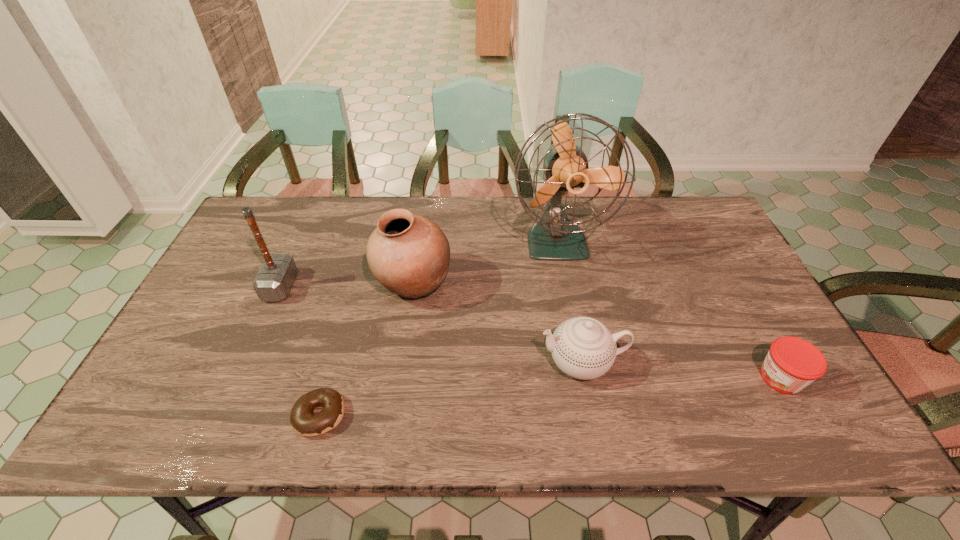
In the image, there is a desktop. At what (x,y) coordinates should I click in order to perform the action: click on vacant space at the far edge. Please return your answer as a coordinate pair (x, y). This screenshot has height=540, width=960. Looking at the image, I should click on (x=424, y=198).

The height and width of the screenshot is (540, 960). Find the location of `vacant region at the near edge of the desktop`. vacant region at the near edge of the desktop is located at coordinates (439, 440).

In order to click on vacant space at the right edge of the desktop in this screenshot , I will do `click(775, 394)`.

In the image, there is a desktop. At what (x,y) coordinates should I click in order to perform the action: click on free space at the far left corner. Please return your answer as a coordinate pair (x, y). This screenshot has width=960, height=540. Looking at the image, I should click on (250, 230).

Locate an element on the screen. This screenshot has width=960, height=540. vacant space at the far right corner of the desktop is located at coordinates (686, 206).

Find the location of a particular element. The height and width of the screenshot is (540, 960). vacant space that's between the shortest object and the fourth tallest object is located at coordinates (451, 388).

I want to click on unoccupied position between the fan and the shortest object, so click(x=439, y=328).

The image size is (960, 540). I want to click on vacant area between the hammer and the shortest object, so click(x=300, y=351).

Identify the location of empty space that is in between the second shortest object and the chinaware. (682, 370).

At what (x,y) coordinates should I click in order to perform the action: click on free spot between the chinaware and the rightmost object. Please return your answer as a coordinate pair (x, y). This screenshot has height=540, width=960. Looking at the image, I should click on (682, 370).